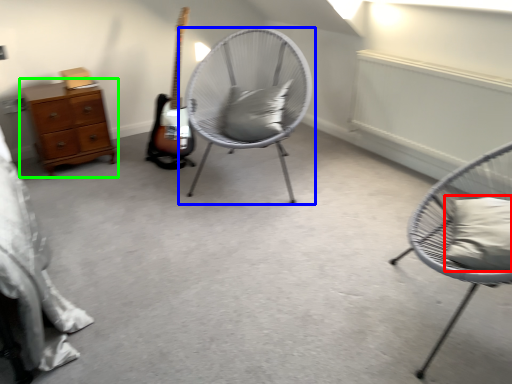
Question: Based on their relative distances, which object is farther from pillow (highlighted by a red box)? Choose from chair (highlighted by a blue box) and chest of drawers (highlighted by a green box).

Choices:
 (A) chair
 (B) chest of drawers

Answer: (B)